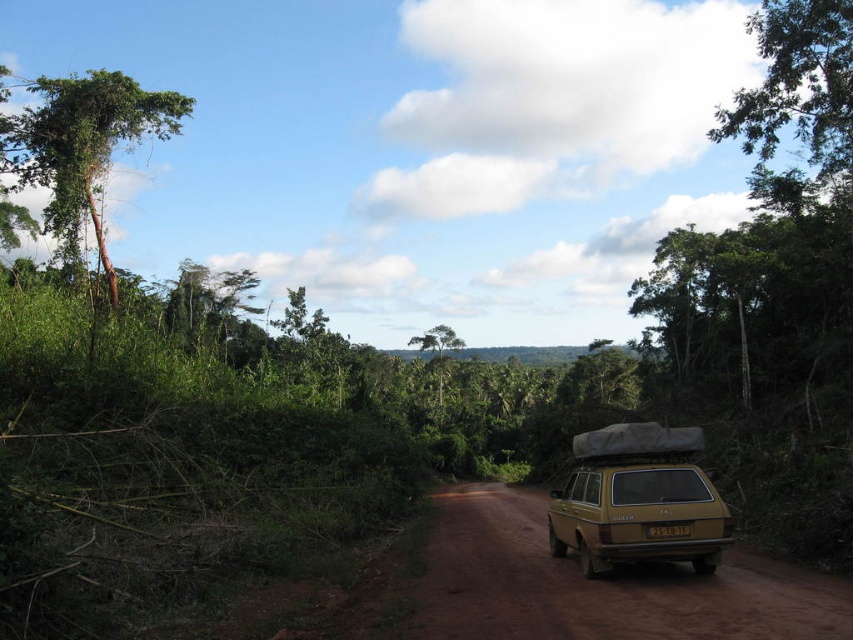
Question: Which of the following is the closest to the observer?

Choices:
 (A) green leafy tree at left
 (B) brown dirt track at center
 (C) gold matte station wagon at center

Answer: (B)

Question: Is green leafy tree at upper right thinner than green leafy tree at center?

Choices:
 (A) yes
 (B) no

Answer: (B)

Question: Which point appears farthest from the camera in this image?

Choices:
 (A) (646, 497)
 (B) (448, 337)

Answer: (B)

Question: Among these points, which one is farthest from the camera?

Choices:
 (A) (619, 577)
 (B) (618, 532)
 (C) (112, 298)

Answer: (C)

Question: Does brown dirt track at center appear under green leafy tree at center?

Choices:
 (A) no
 (B) yes

Answer: (B)

Question: Does brown dirt track at center have a larger size compared to green leafy tree at left?

Choices:
 (A) no
 (B) yes

Answer: (A)